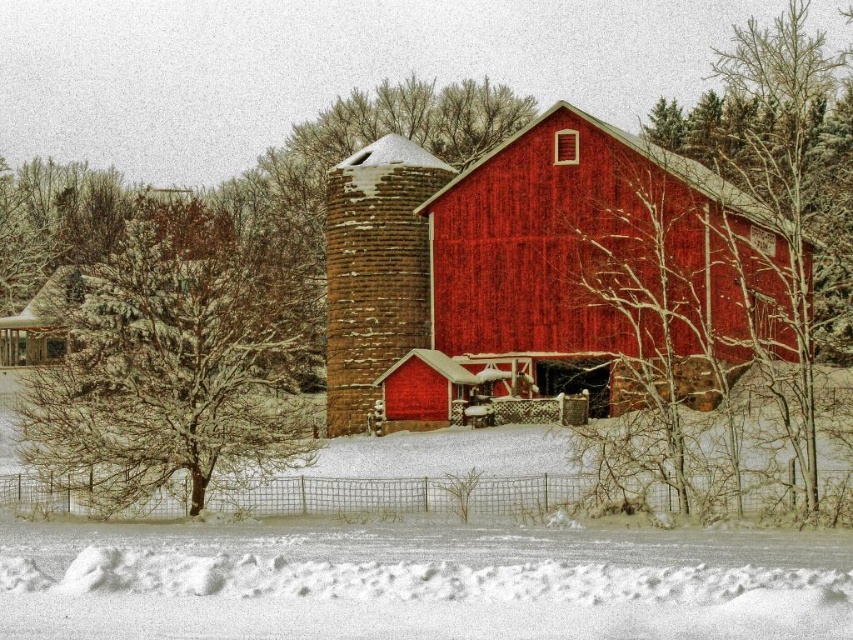
Question: Does snow-covered branches at left appear on the left side of bare branches at center?

Choices:
 (A) no
 (B) yes

Answer: (B)

Question: Which object is the closest to the bare branches at center?

Choices:
 (A) smooth wooden barn at center
 (B) snow-covered branches at left

Answer: (A)

Question: Does snow-covered branches at left come in front of bare branches at center?

Choices:
 (A) yes
 (B) no

Answer: (B)

Question: Which point appears farthest from the camera in this image?

Choices:
 (A) (550, 218)
 (B) (618, 189)
 (C) (306, 428)

Answer: (A)

Question: Which is nearer to the snow-covered branches at left?

Choices:
 (A) bare branches at center
 (B) smooth wooden barn at center

Answer: (B)

Question: Does snow-covered branches at left come in front of bare branches at center?

Choices:
 (A) yes
 (B) no

Answer: (B)